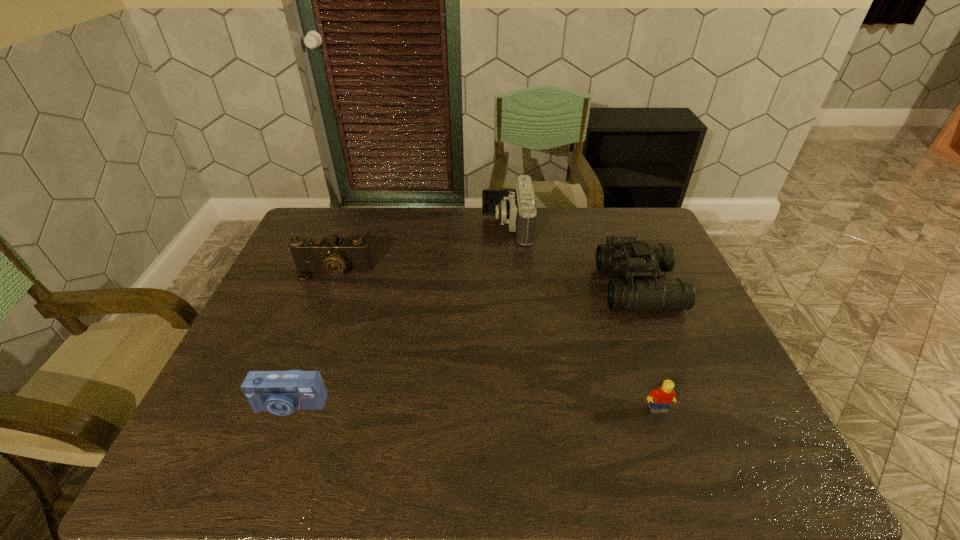
I want to click on the rightmost camera, so click(517, 208).

Locate an element on the screen. the tallest camera is located at coordinates (517, 208).

Find the location of a particular element. binoculars is located at coordinates (627, 255).

Find the location of `the second tallest camera`. the second tallest camera is located at coordinates (333, 255).

The height and width of the screenshot is (540, 960). Identify the location of Lego. (661, 398).

I want to click on the nearest camera, so click(280, 393).

Identify the location of vacant space located 0.320m at the front of the third object from right to left with an open lens cover. (391, 227).

Where is `vacant space located at the front of the third object from right to left with an open lens cover`? The width and height of the screenshot is (960, 540). vacant space located at the front of the third object from right to left with an open lens cover is located at coordinates (368, 227).

At what (x,y) coordinates should I click in order to perform the action: click on vacant space located 0.300m at the front of the third object from right to left with an open lens cover. Please return your answer as a coordinate pair (x, y). The width and height of the screenshot is (960, 540). Looking at the image, I should click on (396, 227).

You are a GUI agent. You are given a task and a screenshot of the screen. Output one action in this format:
    pyautogui.click(x=<x>, y=<y>)
    Task: Click on the vacant space located through the lenses of the binoculars
    The width and height of the screenshot is (960, 540).
    Given the screenshot: What is the action you would take?
    pyautogui.click(x=571, y=288)